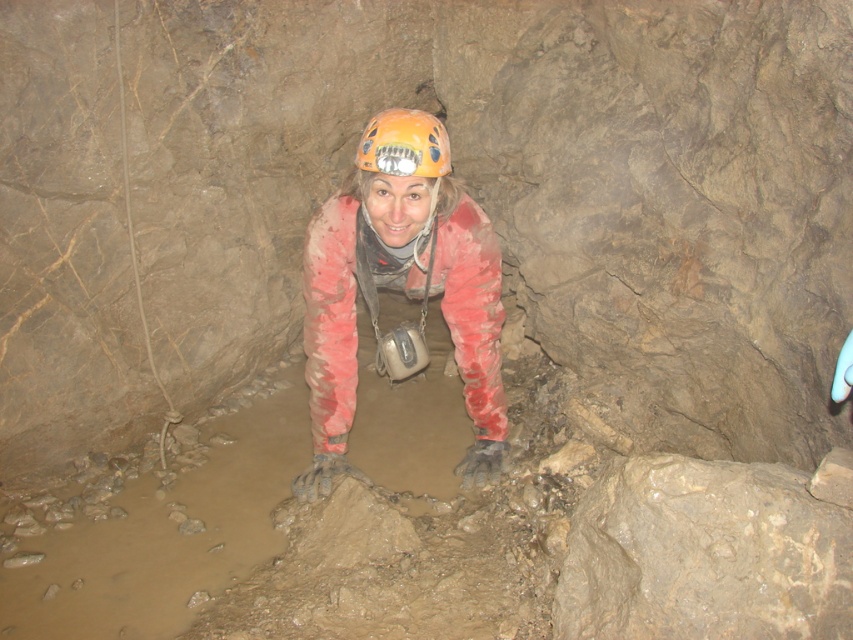
Question: In this image, where is muddy rubber boots at center located relative to orange matte helmet at center?

Choices:
 (A) above
 (B) below

Answer: (B)

Question: Which point appears farthest from the camera in this image?

Choices:
 (A) (392, 176)
 (B) (401, 128)

Answer: (A)

Question: Which object is closer to the camera taking this photo?

Choices:
 (A) muddy rubber boots at center
 (B) orange matte helmet at center

Answer: (B)

Question: Is muddy rubber boots at center above orange matte helmet at center?

Choices:
 (A) yes
 (B) no

Answer: (B)

Question: Can you confirm if muddy rubber boots at center is positioned above orange matte helmet at center?

Choices:
 (A) no
 (B) yes

Answer: (A)

Question: Among these objects, which one is farthest from the camera?

Choices:
 (A) orange matte helmet at center
 (B) muddy rubber boots at center

Answer: (B)